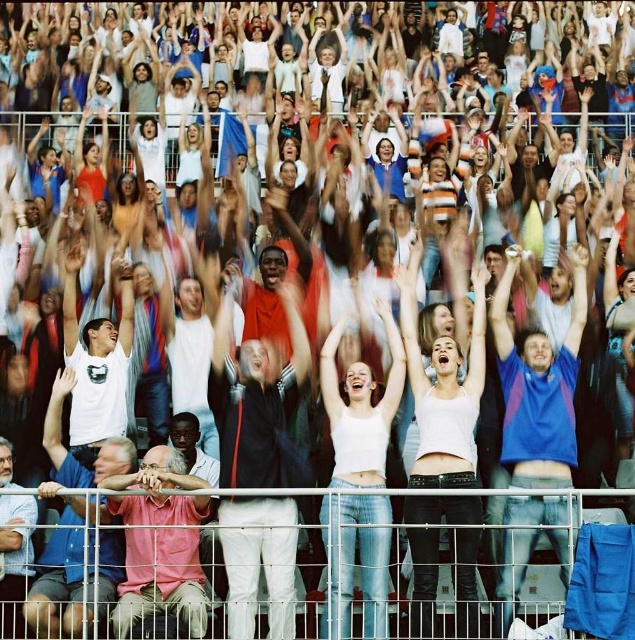
Is point (450, 513) closer to viewer compared to point (178, 609)?

No, it is behind (178, 609).

Is white tank top at center taller than pink cotton shirt at lower left?

Indeed, white tank top at center has a greater height compared to pink cotton shirt at lower left.

The image size is (635, 640). In order to click on white tank top at center in this screenshot , I will do `click(443, 388)`.

Does blue cotton shirt at center have a lesser height compared to white cotton tank top at center?

No, blue cotton shirt at center is not shorter than white cotton tank top at center.

In order to click on blue cotton shirt at center in this screenshot , I will do `click(538, 385)`.

Does point (277, 465) come farther from viewer compared to point (450, 358)?

No, (277, 465) is in front of (450, 358).

The width and height of the screenshot is (635, 640). I want to click on black matte jacket at center, so click(x=255, y=394).